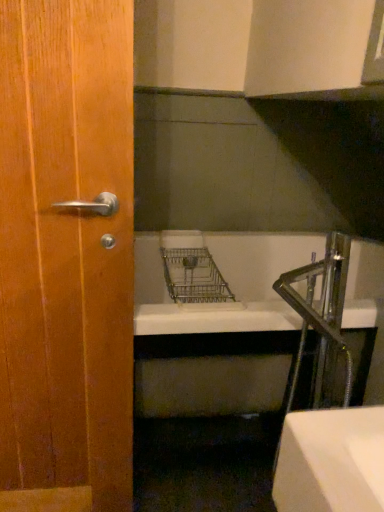
Question: Is wooden door handle at left bigger than chrome metallic faucet at right?

Choices:
 (A) yes
 (B) no

Answer: (A)

Question: Is wooden door handle at left next to chrome metallic faucet at right and touching it?

Choices:
 (A) no
 (B) yes

Answer: (A)

Question: Does wooden door handle at left come in front of chrome metallic faucet at right?

Choices:
 (A) yes
 (B) no

Answer: (A)

Question: Is chrome metallic faucet at right surrounded by wooden door handle at left?

Choices:
 (A) no
 (B) yes

Answer: (A)

Question: Does wooden door handle at left have a greater height compared to chrome metallic faucet at right?

Choices:
 (A) no
 (B) yes

Answer: (B)

Question: From a real-world perspective, is wooden door handle at left positioned under chrome metallic faucet at right based on gravity?

Choices:
 (A) no
 (B) yes

Answer: (A)

Question: Can you confirm if chrome metallic faucet at right is smaller than wooden door handle at left?

Choices:
 (A) yes
 (B) no

Answer: (A)

Question: Considering the relative positions of chrome metallic faucet at right and wooden door handle at left in the image provided, is chrome metallic faucet at right in front of wooden door handle at left?

Choices:
 (A) no
 (B) yes

Answer: (A)

Question: Is chrome metallic faucet at right at the left side of wooden door handle at left?

Choices:
 (A) yes
 (B) no

Answer: (B)

Question: Considering the relative sizes of chrome metallic faucet at right and wooden door handle at left in the image provided, is chrome metallic faucet at right taller than wooden door handle at left?

Choices:
 (A) no
 (B) yes

Answer: (A)

Question: Is there a large distance between chrome metallic faucet at right and wooden door handle at left?

Choices:
 (A) yes
 (B) no

Answer: (B)

Question: From a real-world perspective, is chrome metallic faucet at right on wooden door handle at left?

Choices:
 (A) yes
 (B) no

Answer: (B)

Question: Is chrome metallic faucet at right to the left or to the right of wooden door handle at left in the image?

Choices:
 (A) left
 (B) right

Answer: (B)